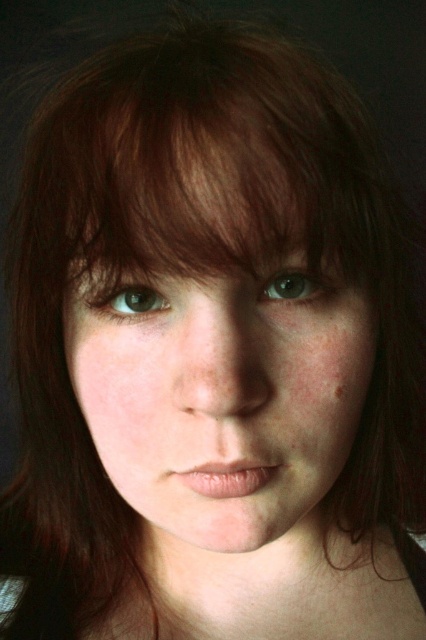
Is green matte eye at center wider than brown matte eye at center?

Incorrect, green matte eye at center's width does not surpass brown matte eye at center's.

Between green matte eye at center and brown matte eye at center, which one is positioned higher?

green matte eye at center

Image resolution: width=426 pixels, height=640 pixels. Describe the element at coordinates (296, 284) in the screenshot. I see `green matte eye at center` at that location.

Locate an element on the screen. green matte eye at center is located at coordinates click(x=296, y=284).

Who is more distant from viewer, (x=288, y=273) or (x=333, y=394)?

The point (x=333, y=394) is behind.

Between green matte eye at center and brown matte freckle at lower right, which one has more height?

Standing taller between the two is green matte eye at center.

This screenshot has width=426, height=640. Identify the location of green matte eye at center. (296, 284).

Between brown matte eye at center and brown matte freckle at lower right, which one is positioned lower?

brown matte freckle at lower right is lower down.

You are a GUI agent. You are given a task and a screenshot of the screen. Output one action in this format:
    pyautogui.click(x=<x>, y=<y>)
    Task: Click on the brown matte eye at center
    This screenshot has width=426, height=640.
    Given the screenshot: What is the action you would take?
    pyautogui.click(x=129, y=300)

Find the location of a particular element. The image size is (426, 640). brown matte eye at center is located at coordinates pyautogui.click(x=129, y=300).